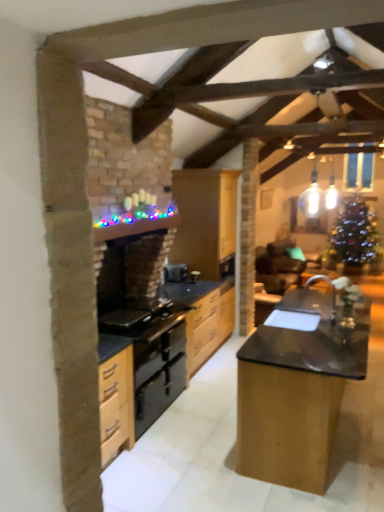
Question: From a real-world perspective, relative to black granite countertop at center, is black matte oven at center vertically above or below?

Choices:
 (A) above
 (B) below

Answer: (A)

Question: Is point (178, 270) positioned closer to the camera than point (231, 309)?

Choices:
 (A) farther
 (B) closer

Answer: (B)

Question: Considering the real-world distances, which object is farthest from the black granite countertop at center?

Choices:
 (A) black granite sink at center
 (B) black polished wood table at center
 (C) black matte oven at center
 (D) teal fabric armchair at center
 (E) wooden cabinets at center

Answer: (B)

Question: Estimate the real-world distances between objects in this image. Which object is closer to the teal fabric armchair at center?

Choices:
 (A) black granite countertop at center
 (B) wooden cabinets at center
 (C) black granite sink at center
 (D) black polished wood table at center
 (E) black matte oven at center

Answer: (C)